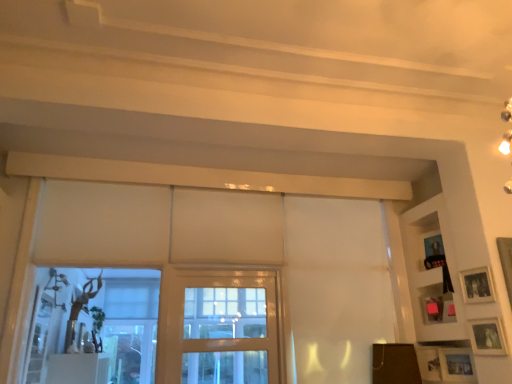
Question: Does matte black picture frame at upper right, acting as the fourth picture frame starting from the bottom, have a lesser height compared to matte white picture frame at lower right, the 3th picture frame when ordered from top to bottom?

Choices:
 (A) yes
 (B) no

Answer: (B)

Question: Is matte white picture frame at lower right, the 3th picture frame when ordered from top to bottom, at the back of matte black picture frame at upper right, acting as the first picture frame starting from the top?

Choices:
 (A) yes
 (B) no

Answer: (B)

Question: From the image's perspective, does matte black picture frame at upper right, acting as the first picture frame starting from the top, appear lower than matte white picture frame at lower right, the 2th picture frame positioned from the bottom?

Choices:
 (A) yes
 (B) no

Answer: (B)

Question: Considering the relative sizes of matte black picture frame at upper right, acting as the first picture frame starting from the top, and matte white picture frame at lower right, the 2th picture frame positioned from the bottom, in the image provided, is matte black picture frame at upper right, acting as the first picture frame starting from the top, smaller than matte white picture frame at lower right, the 2th picture frame positioned from the bottom,?

Choices:
 (A) yes
 (B) no

Answer: (B)

Question: Is matte black picture frame at upper right, acting as the fourth picture frame starting from the bottom, at the left side of matte white picture frame at lower right, the 3th picture frame when ordered from top to bottom?

Choices:
 (A) yes
 (B) no

Answer: (A)

Question: Considering the relative sizes of matte black picture frame at upper right, acting as the first picture frame starting from the top, and matte white picture frame at lower right, the 3th picture frame when ordered from top to bottom, in the image provided, is matte black picture frame at upper right, acting as the first picture frame starting from the top, thinner than matte white picture frame at lower right, the 3th picture frame when ordered from top to bottom,?

Choices:
 (A) yes
 (B) no

Answer: (B)

Question: Is matte white picture frame at lower right, the 2th picture frame positioned from the bottom, placed right next to white matte curtain at center?

Choices:
 (A) yes
 (B) no

Answer: (B)

Question: Does matte white picture frame at lower right, the 2th picture frame positioned from the bottom, lie in front of white matte curtain at center?

Choices:
 (A) no
 (B) yes

Answer: (B)

Question: Is matte white picture frame at lower right, the 2th picture frame positioned from the bottom, not close to white matte curtain at center?

Choices:
 (A) no
 (B) yes

Answer: (B)

Question: From a real-world perspective, is matte white picture frame at lower right, the 3th picture frame when ordered from top to bottom, beneath white matte curtain at center?

Choices:
 (A) yes
 (B) no

Answer: (A)

Question: Does matte white picture frame at lower right, the 3th picture frame when ordered from top to bottom, have a greater height compared to white matte curtain at center?

Choices:
 (A) no
 (B) yes

Answer: (A)

Question: From the image's perspective, is matte white picture frame at lower right, the 2th picture frame positioned from the bottom, located beneath white matte curtain at center?

Choices:
 (A) no
 (B) yes

Answer: (B)

Question: Considering the relative positions of pink matte picture frame at right, the 2th picture frame positioned from the top, and clear glass screen door at center in the image provided, is pink matte picture frame at right, the 2th picture frame positioned from the top, to the right of clear glass screen door at center from the viewer's perspective?

Choices:
 (A) yes
 (B) no

Answer: (A)